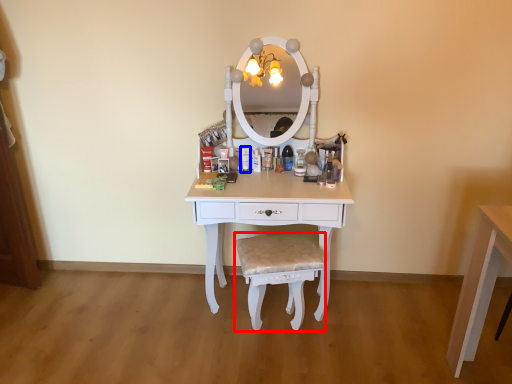
Question: Which point is further to the camera, chair (highlighted by a red box) or toiletry (highlighted by a blue box)?

Choices:
 (A) chair
 (B) toiletry

Answer: (B)